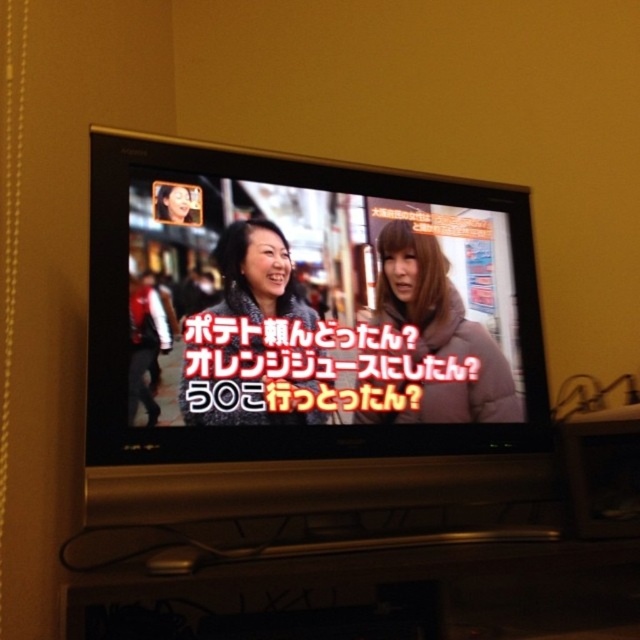
The height and width of the screenshot is (640, 640). What do you see at coordinates (305, 308) in the screenshot?
I see `matte black television at center` at bounding box center [305, 308].

Based on the photo, does matte black television at center appear on the right side of matte gray jacket at center?

Correct, you'll find matte black television at center to the right of matte gray jacket at center.

At what (x,y) coordinates should I click in order to perform the action: click on matte black television at center. Please return your answer as a coordinate pair (x, y). The width and height of the screenshot is (640, 640). Looking at the image, I should click on (305, 308).

Does matte black television at center appear under puffy brown jacket at center?

Incorrect, matte black television at center is not positioned below puffy brown jacket at center.

Identify the location of matte black television at center. This screenshot has height=640, width=640. (305, 308).

Who is lower down, puffy brown jacket at center or matte gray jacket at center?

Positioned lower is puffy brown jacket at center.

Locate an element on the screen. puffy brown jacket at center is located at coordinates [x=438, y=332].

Is point (422, 248) positioned before point (236, 387)?

No.

At what (x,y) coordinates should I click in order to perform the action: click on puffy brown jacket at center. Please return your answer as a coordinate pair (x, y). Image resolution: width=640 pixels, height=640 pixels. Looking at the image, I should click on (438, 332).